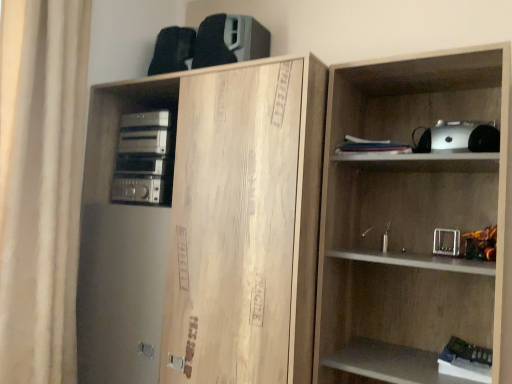
Identify the location of free space above white matte book at lower right, the 2th book positioned from the top (from a real-world perspective). (466, 351).